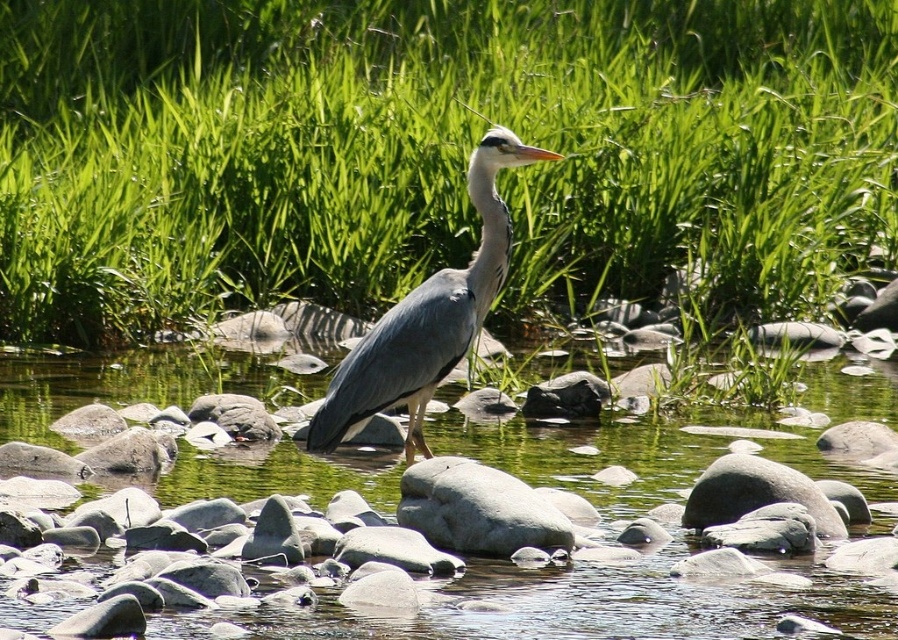
Is point (494, 474) positioned behind point (782, 493)?

No, it is not.

Between point (533, 502) and point (775, 500), which one is positioned behind?

Point (775, 500)

Who is more forward, (507, 524) or (727, 502)?

Point (507, 524)

Where is `gray smooth rock at center`? This screenshot has width=898, height=640. gray smooth rock at center is located at coordinates (477, 509).

Between point (434, 253) and point (527, 506), which one is positioned in front?

Positioned in front is point (527, 506).

Does green grass at upper center have a lesser height compared to gray smooth rock at center?

Incorrect, green grass at upper center's height does not fall short of gray smooth rock at center's.

Measure the distance between green grass at upper center and camera.

green grass at upper center and camera are 20.58 feet apart.

This screenshot has width=898, height=640. Identify the location of green grass at upper center. (437, 154).

Who is more forward, (x=302, y=628) or (x=782, y=472)?

Point (x=302, y=628) is more forward.

Is green smooth water at center wider than gray smooth rock at center-right?

Yes, green smooth water at center is wider than gray smooth rock at center-right.

What are the coordinates of `green smooth water at center` in the screenshot? It's located at (587, 604).